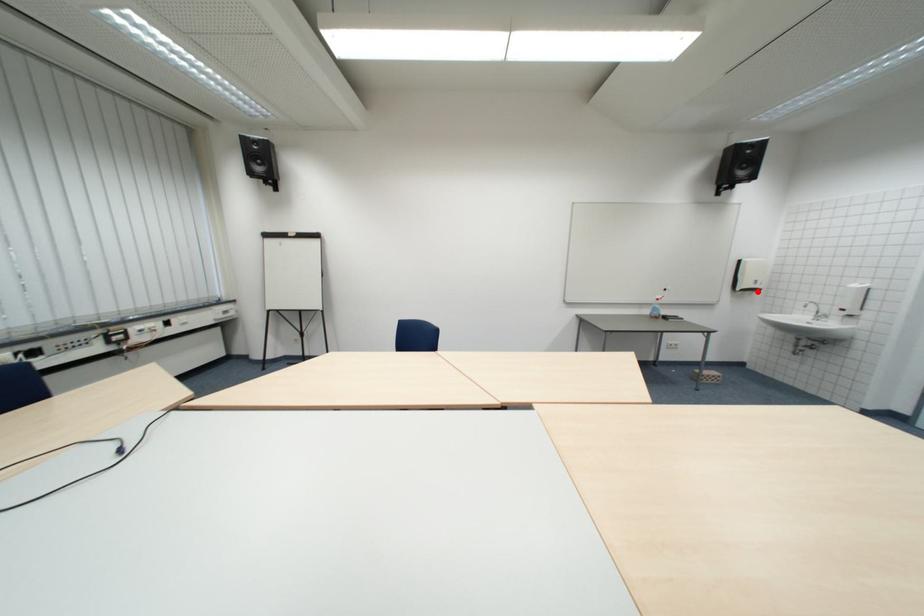
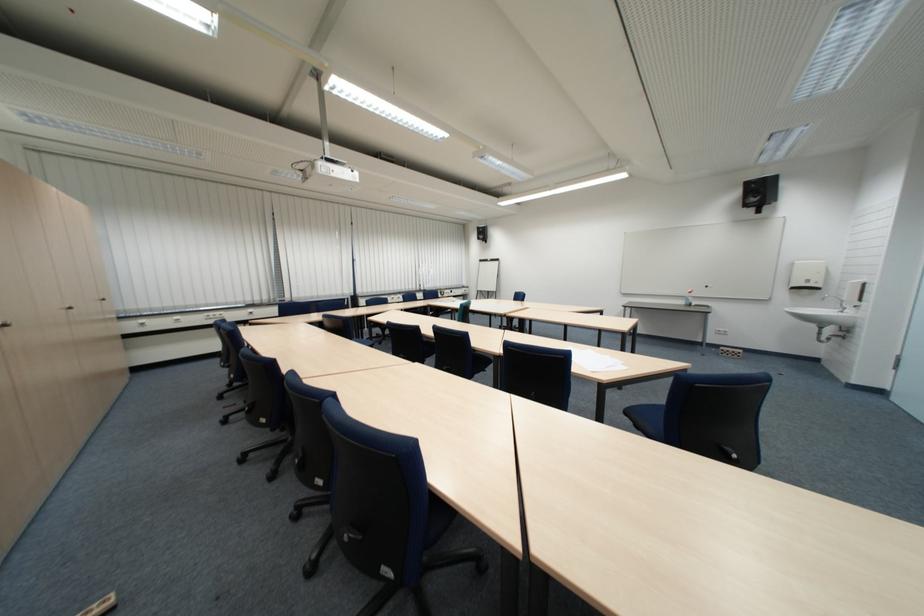
Find the pixel in the second image that matches the highlighted location in the first image.

(807, 290)